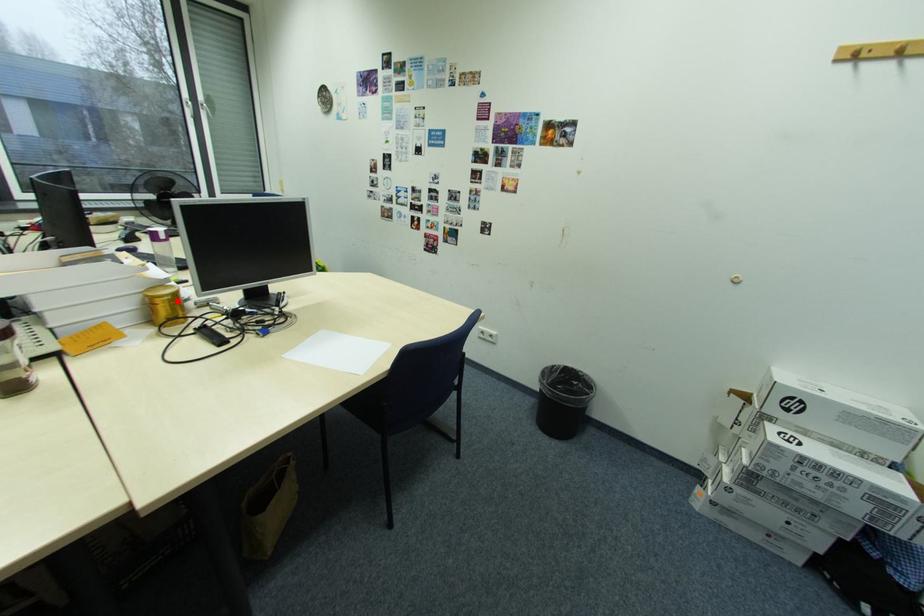
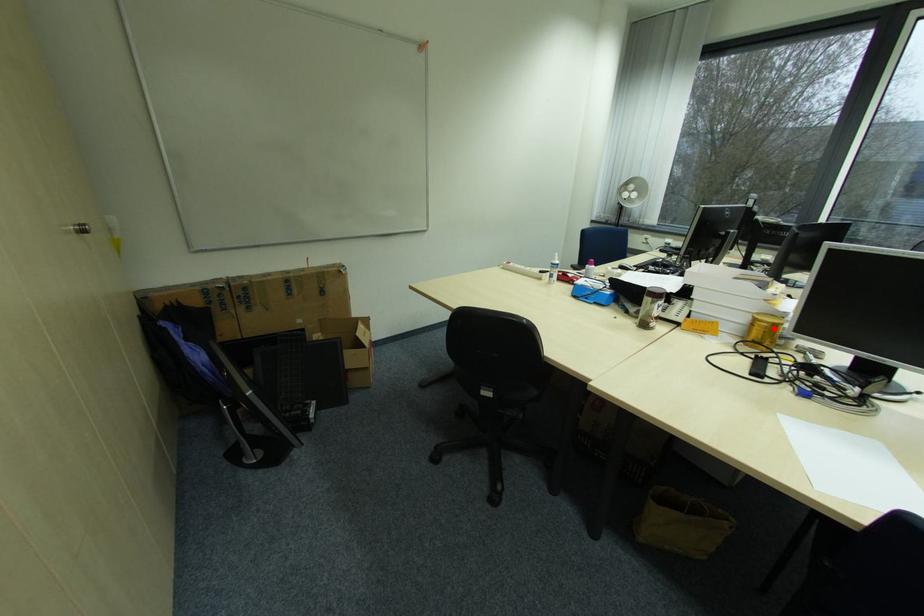
I am providing you with two images of the same scene from different viewpoints. A red point is marked on the first image and another point is marked on the second image. Do the highlighted points in image1 and image2 indicate the same real-world spot?

Yes